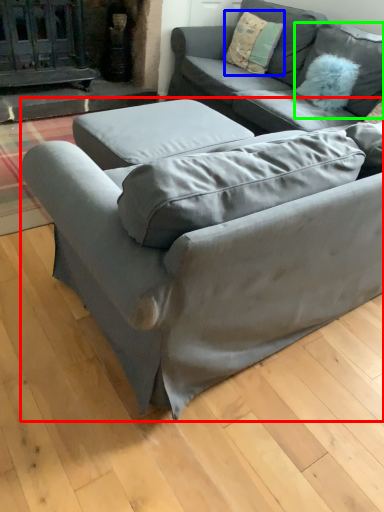
Question: Based on their relative distances, which object is nearer to studio couch (highlighted by a red box)? Choose from pillow (highlighted by a blue box) and pillow (highlighted by a green box).

Choices:
 (A) pillow
 (B) pillow

Answer: (B)